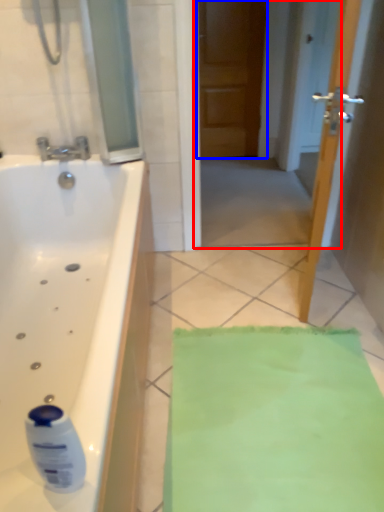
Question: Which object appears farthest to the camera in this image, screen door (highlighted by a red box) or door (highlighted by a blue box)?

Choices:
 (A) screen door
 (B) door

Answer: (B)